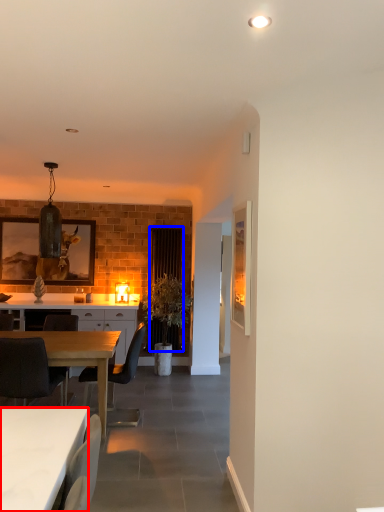
Question: Which object is closer to the camera taking this photo, desk (highlighted by a red box) or curtain (highlighted by a blue box)?

Choices:
 (A) desk
 (B) curtain

Answer: (A)